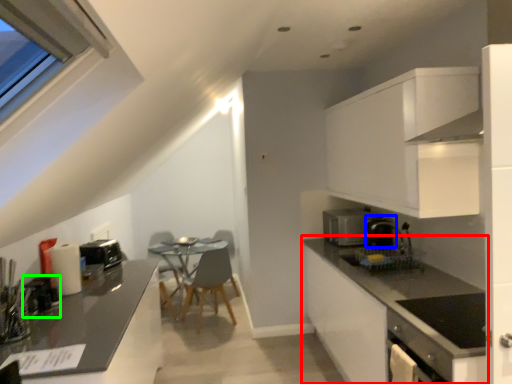
Question: Which object is positioned closest to countertop (highlighted by a red box)? Select from coffee machine (highlighted by a blue box) and appliance (highlighted by a green box).

Choices:
 (A) coffee machine
 (B) appliance

Answer: (A)